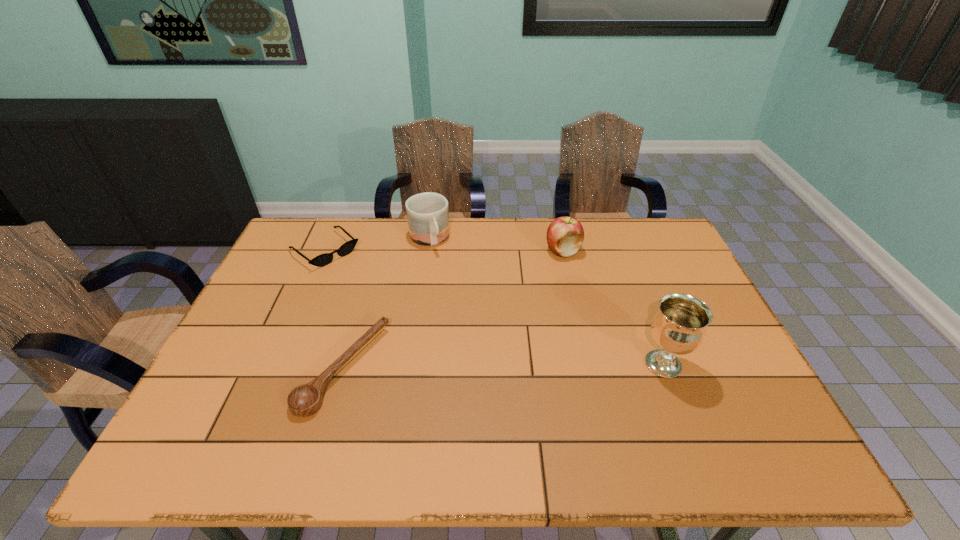
Find the location of a particular element. The image size is (960, 540). free space located on the side with the handle of the mug is located at coordinates (464, 318).

This screenshot has width=960, height=540. What are the coordinates of `vacant space located on the bitten side of the fourth object from left to right` in the screenshot? It's located at (550, 268).

Identify the location of vacant space situated on the bitten side of the fourth object from left to right. This screenshot has width=960, height=540. (516, 317).

Locate an element on the screen. This screenshot has height=540, width=960. vacant space located 0.170m on the bitten side of the fourth object from left to right is located at coordinates (534, 291).

This screenshot has width=960, height=540. I want to click on vacant region located 0.220m on the front-facing side of the sunglasses, so click(x=385, y=301).

Locate an element on the screen. The width and height of the screenshot is (960, 540). blank space located on the front-facing side of the sunglasses is located at coordinates (420, 330).

In order to click on vacant space situated on the front-facing side of the sunglasses in this screenshot , I will do `click(399, 313)`.

The height and width of the screenshot is (540, 960). I want to click on mug at the far edge, so click(x=427, y=213).

Where is `apple present at the far edge`? The image size is (960, 540). apple present at the far edge is located at coordinates (565, 235).

Identify the location of sunglasses located in the far edge section of the desktop. The height and width of the screenshot is (540, 960). (324, 259).